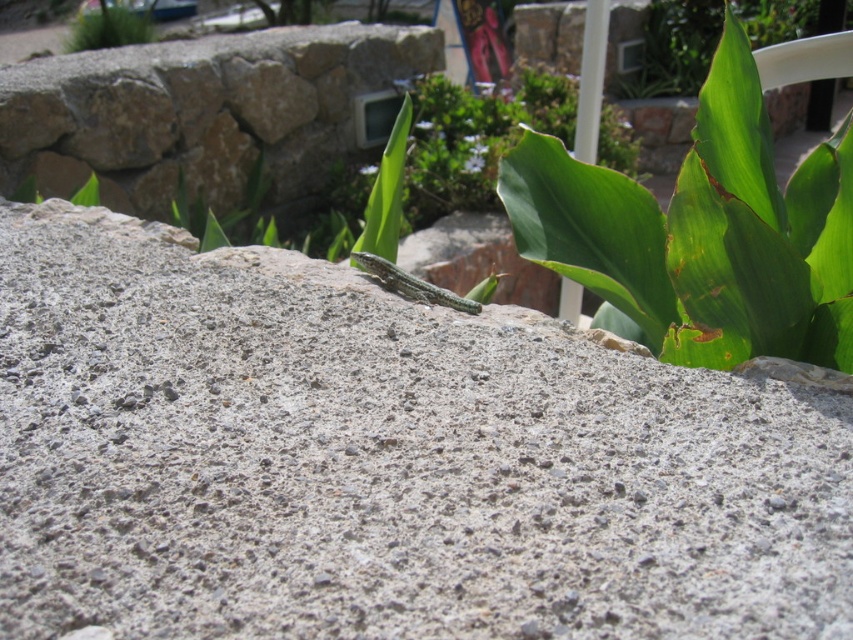
Can you confirm if green leafy plant at center right is shorter than green leafy plant at upper left?

Incorrect, green leafy plant at center right's height does not fall short of green leafy plant at upper left's.

Is point (712, 68) positioned in front of point (93, 35)?

Yes, it is in front of point (93, 35).

Where is `green leafy plant at center right`? The height and width of the screenshot is (640, 853). green leafy plant at center right is located at coordinates (703, 232).

Does point (71, 36) lie in front of point (405, 288)?

No.

Is green leafy plant at upper left closer to the viewer compared to green scaly lizard at center?

No, it is behind green scaly lizard at center.

Where is `green leafy plant at upper left`? The height and width of the screenshot is (640, 853). green leafy plant at upper left is located at coordinates (109, 26).

The width and height of the screenshot is (853, 640). I want to click on gray rough concrete at center, so click(x=381, y=460).

Is point (68, 209) less distant than point (668, 236)?

No, it is not.

The image size is (853, 640). I want to click on gray rough concrete at center, so click(x=381, y=460).